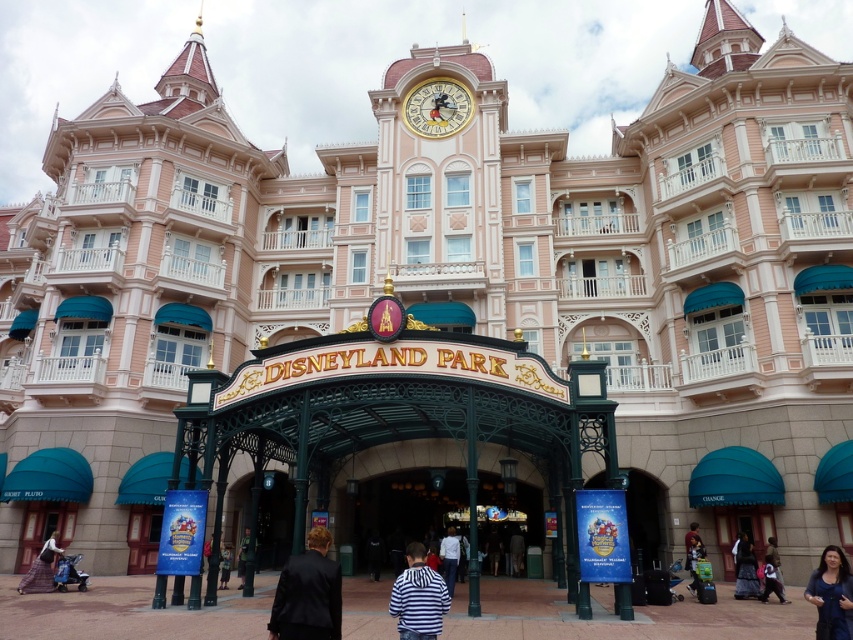
Question: Among these points, which one is nearest to the camera?

Choices:
 (A) (447, 531)
 (B) (281, 572)
 (C) (842, 586)

Answer: (C)

Question: Considering the relative positions of matte pink dress at lower left and dark blue fabric pants at lower right in the image provided, where is matte pink dress at lower left located with respect to dark blue fabric pants at lower right?

Choices:
 (A) left
 (B) right

Answer: (A)

Question: Can you confirm if black suit at center is positioned to the right of light brown leather jacket at lower center?

Choices:
 (A) no
 (B) yes

Answer: (B)

Question: Which of the following is the farthest from the observer?

Choices:
 (A) white cotton shirt at center
 (B) matte pink dress at lower left
 (C) light brown leather jacket at lower center

Answer: (C)

Question: Does blue satin dress at lower right have a lesser width compared to dark gray fabric dress at lower right?

Choices:
 (A) no
 (B) yes

Answer: (A)

Question: Which object is positioned farthest from the gold metallic clock at upper center?

Choices:
 (A) dark blue fabric pants at lower right
 (B) light brown leather jacket at lower center
 (C) white cotton shirt at center

Answer: (A)